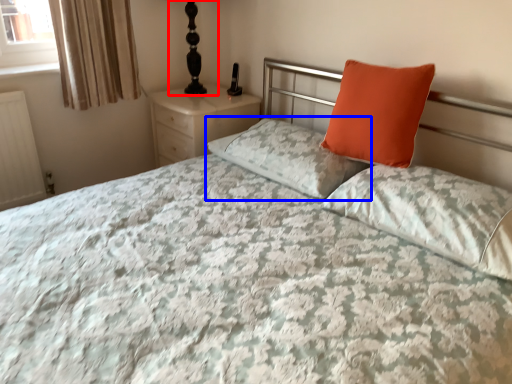
Question: Which of the following is the closest to the observer, table lamp (highlighted by a red box) or pillow (highlighted by a blue box)?

Choices:
 (A) table lamp
 (B) pillow

Answer: (B)